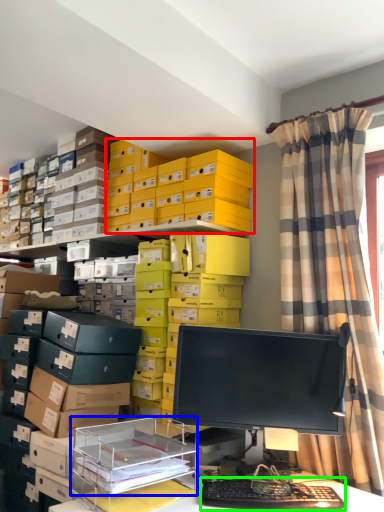
Question: Based on their relative distances, which object is nearer to storage box (highlighted by a red box)? Choose from shelf (highlighted by a blue box) and computer keyboard (highlighted by a green box).

Choices:
 (A) shelf
 (B) computer keyboard

Answer: (A)